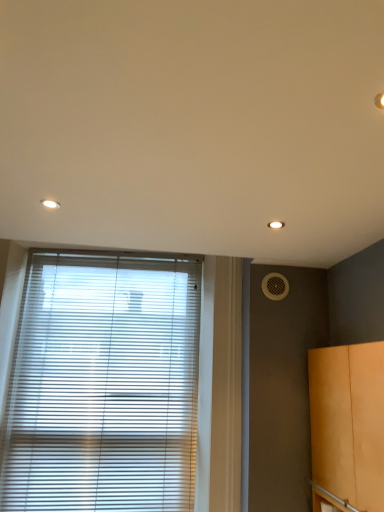
Measure the distance between white plastic blinds at lower left and camera.

white plastic blinds at lower left is 1.94 meters from camera.

At what (x,y) coordinates should I click in order to perform the action: click on white mesh air conditioning at right. Please return your answer as a coordinate pair (x, y). Image resolution: width=384 pixels, height=512 pixels. Looking at the image, I should click on (275, 286).

Would you say white mesh air conditioning at right is a long distance from matte orange cabinet at right?

white mesh air conditioning at right is near matte orange cabinet at right, not far away.

Looking at this image, is white mesh air conditioning at right wider than matte orange cabinet at right?

In fact, white mesh air conditioning at right might be narrower than matte orange cabinet at right.

Who is more distant, white mesh air conditioning at right or matte orange cabinet at right?

Positioned behind is white mesh air conditioning at right.

Does white mesh air conditioning at right touch white plastic blinds at lower left?

No, white mesh air conditioning at right is not next to white plastic blinds at lower left.

Which is behind, white mesh air conditioning at right or white plastic blinds at lower left?

white mesh air conditioning at right is further away from the camera.

Which object is positioned more to the left, white mesh air conditioning at right or white plastic blinds at lower left?

white plastic blinds at lower left is more to the left.

Is white mesh air conditioning at right oriented towards white plastic blinds at lower left?

No.

Is white plastic blinds at lower left positioned before white mesh air conditioning at right?

Yes, white plastic blinds at lower left is closer to the viewer.

Find the location of a particular element. This screenshot has height=512, width=384. window blind located below the white mesh air conditioning at right (from the image's perspective) is located at coordinates (103, 385).

Which of these two, white plastic blinds at lower left or white mesh air conditioning at right, is wider?

With larger width is white plastic blinds at lower left.

Choose the correct answer: Is white plastic blinds at lower left inside white mesh air conditioning at right or outside it?

white plastic blinds at lower left is not inside white mesh air conditioning at right, it's outside.

Find the location of `window blind above the matte orange cabinet at right (from the image's perspective)`. window blind above the matte orange cabinet at right (from the image's perspective) is located at coordinates (103, 385).

How distant is white plastic blinds at lower left from matte orange cabinet at right?

white plastic blinds at lower left and matte orange cabinet at right are 37.05 inches apart from each other.

Which of these two, white plastic blinds at lower left or matte orange cabinet at right, is smaller?

white plastic blinds at lower left is smaller.

Considering the sizes of objects white plastic blinds at lower left and matte orange cabinet at right in the image provided, who is taller, white plastic blinds at lower left or matte orange cabinet at right?

white plastic blinds at lower left.

How many degrees apart are the facing directions of matte orange cabinet at right and white mesh air conditioning at right?

The facing directions of matte orange cabinet at right and white mesh air conditioning at right are 89.4 degrees apart.

Considering the relative positions of matte orange cabinet at right and white mesh air conditioning at right in the image provided, is matte orange cabinet at right to the left or to the right of white mesh air conditioning at right?

Based on their positions, matte orange cabinet at right is located to the right of white mesh air conditioning at right.

Is point (377, 382) closer or farther from the camera than point (284, 291)?

Point (377, 382) appears to be closer to the viewer than point (284, 291).

Would you say matte orange cabinet at right is inside or outside white mesh air conditioning at right?

matte orange cabinet at right cannot be found inside white mesh air conditioning at right.

Is matte orange cabinet at right far away from white plastic blinds at lower left?

No, there isn't a large distance between matte orange cabinet at right and white plastic blinds at lower left.

From a real-world perspective, who is located lower, matte orange cabinet at right or white plastic blinds at lower left?

matte orange cabinet at right, from a real-world perspective.

Can you confirm if matte orange cabinet at right is shorter than white plastic blinds at lower left?

Correct, matte orange cabinet at right is not as tall as white plastic blinds at lower left.

In the scene shown: Does matte orange cabinet at right appear on the left side of white plastic blinds at lower left?

No.

You are a GUI agent. You are given a task and a screenshot of the screen. Output one action in this format:
    pyautogui.click(x=<x>, y=<y>)
    Task: Click on the air conditioning on the left of matte orange cabinet at right
    
    Given the screenshot: What is the action you would take?
    pyautogui.click(x=275, y=286)

Find the location of `air conditioning above the white plastic blinds at lower left (from a real-world perspective)`. air conditioning above the white plastic blinds at lower left (from a real-world perspective) is located at coordinates [275, 286].

Which object lies nearer to the anchor point matte orange cabinet at right, white mesh air conditioning at right or white plastic blinds at lower left?

white mesh air conditioning at right is positioned closer to the anchor matte orange cabinet at right.

Considering their positions, is white mesh air conditioning at right positioned further to white plastic blinds at lower left than matte orange cabinet at right?

Based on the image, matte orange cabinet at right appears to be further to white plastic blinds at lower left.

Which object lies further to the anchor point matte orange cabinet at right, white plastic blinds at lower left or white mesh air conditioning at right?

The object further to matte orange cabinet at right is white plastic blinds at lower left.

Based on their spatial positions, is matte orange cabinet at right or white mesh air conditioning at right closer to white plastic blinds at lower left?

white mesh air conditioning at right is closer to white plastic blinds at lower left.

Based on their spatial positions, is matte orange cabinet at right or white plastic blinds at lower left further from white mesh air conditioning at right?

white plastic blinds at lower left is further to white mesh air conditioning at right.

When comparing their distances from white mesh air conditioning at right, does white plastic blinds at lower left or matte orange cabinet at right seem further?

Based on the image, white plastic blinds at lower left appears to be further to white mesh air conditioning at right.

Identify the location of air conditioning situated between white plastic blinds at lower left and matte orange cabinet at right from left to right. The image size is (384, 512). click(275, 286).